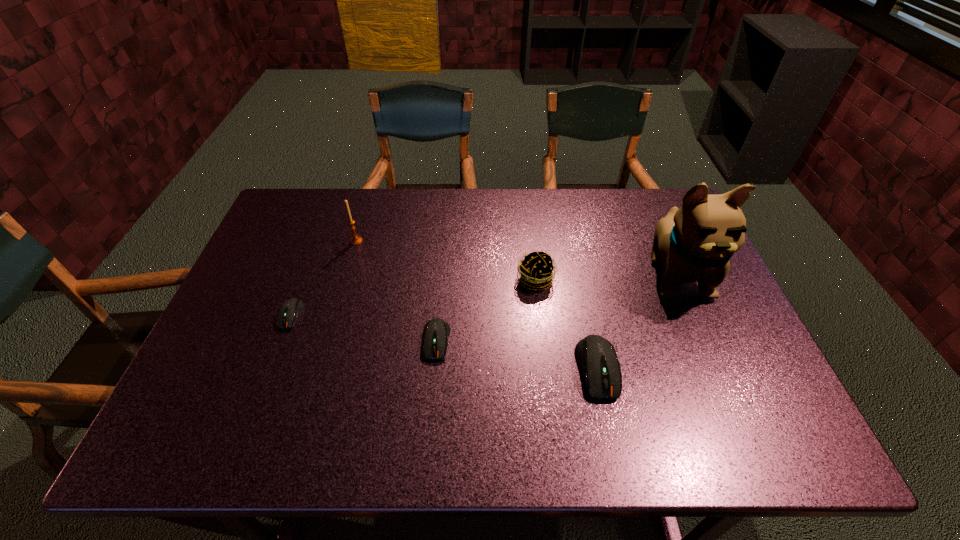
The width and height of the screenshot is (960, 540). Find the location of `the third object from right to left`. the third object from right to left is located at coordinates (536, 268).

Locate an element on the screen. the third tallest object is located at coordinates (536, 268).

At what (x,y) coordinates should I click in order to perform the action: click on vacant region located on the button of the shortest object. Please return your answer as a coordinate pair (x, y). Looking at the image, I should click on (264, 387).

The height and width of the screenshot is (540, 960). In order to click on free space located 0.100m on the button of the second shortest computer equipment in this screenshot , I will do `click(431, 400)`.

Find the location of `free location located on the face of the rightmost object`. free location located on the face of the rightmost object is located at coordinates (712, 355).

This screenshot has height=540, width=960. What are the coordinates of `blank area located 0.160m on the left of the fifth object from right to left` in the screenshot? It's located at (298, 241).

Locate an element on the screen. This screenshot has width=960, height=540. vacant space situated on the right of the fourth shortest object is located at coordinates (630, 279).

The width and height of the screenshot is (960, 540). I want to click on object that is at the near edge, so click(597, 357).

This screenshot has width=960, height=540. I want to click on object that is at the left edge, so click(x=289, y=311).

Where is `object that is at the right edge`? Image resolution: width=960 pixels, height=540 pixels. object that is at the right edge is located at coordinates coord(694,243).